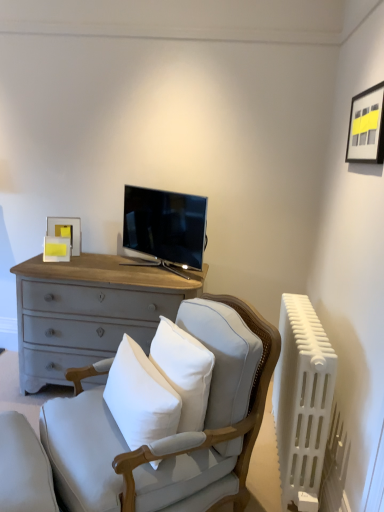
Find the location of a particular element. The image size is (384, 512). matte black picture frame at upper right, the 2th picture frame ordered from the bottom is located at coordinates (366, 127).

Measure the distance between matte black picture frame at upper right, the 2th picture frame ordered from the bottom, and camera.

matte black picture frame at upper right, the 2th picture frame ordered from the bottom, and camera are 1.76 meters apart.

What are the coordinates of `matte black tv at center` in the screenshot? It's located at (165, 229).

The image size is (384, 512). What do you see at coordinates (165, 229) in the screenshot? I see `matte black tv at center` at bounding box center [165, 229].

Where is `matte gray cushion at lower left`? The height and width of the screenshot is (512, 384). matte gray cushion at lower left is located at coordinates (23, 468).

Locate an element on the screen. This screenshot has width=384, height=512. matte black picture frame at upper right, which is counted as the 1th picture frame, starting from the right is located at coordinates coord(366,127).

Looking at this image, which object is further away from the camera taking this photo, matte gray cushion at lower left or matte black tv at center?

matte black tv at center is more distant.

Is matte gray cushion at lower left smaller than matte black tv at center?

Indeed, matte gray cushion at lower left has a smaller size compared to matte black tv at center.

From a real-world perspective, which is physically below, matte gray cushion at lower left or matte black tv at center?

matte gray cushion at lower left, from a real-world perspective.

You are a GUI agent. You are given a task and a screenshot of the screen. Output one action in this format:
    pyautogui.click(x=<x>, y=<y>)
    Task: Click on the gray below the matte black tv at center (from the image's perspective)
    This screenshot has width=384, height=512.
    Given the screenshot: What is the action you would take?
    pyautogui.click(x=23, y=468)

Considering the relative sizes of white cotton pillow at center and matte yellow picture frame at upper left, the 2th picture frame in the top-to-bottom sequence, in the image provided, is white cotton pillow at center wider than matte yellow picture frame at upper left, the 2th picture frame in the top-to-bottom sequence,?

Yes.

Are white cotton pillow at center and matte yellow picture frame at upper left, the 2th picture frame in the top-to-bottom sequence, far apart?

Indeed, white cotton pillow at center is not near matte yellow picture frame at upper left, the 2th picture frame in the top-to-bottom sequence.

From a real-world perspective, is white cotton pillow at center positioned under matte yellow picture frame at upper left, the 1th picture frame positioned from the bottom, based on gravity?

Yes.

In the image, there is a matte yellow picture frame at upper left, the 2th picture frame in the front-to-back sequence. Where is `pillow below it (from a real-world perspective)`? This screenshot has height=512, width=384. pillow below it (from a real-world perspective) is located at coordinates (140, 397).

Considering the positions of point (372, 109) and point (34, 488), is point (372, 109) closer or farther from the camera than point (34, 488)?

Clearly, point (372, 109) is more distant from the camera than point (34, 488).

From a real-world perspective, count 2nd picture frames upward from the matte gray cushion at lower left and point to it. Please provide its 2D coordinates.

[(366, 127)]

Does matte black picture frame at upper right, which is counted as the 1th picture frame, starting from the right, come behind matte gray cushion at lower left?

Yes.

Is matte black picture frame at upper right, which is counted as the 1th picture frame, starting from the top, shorter than matte gray cushion at lower left?

Correct, matte black picture frame at upper right, which is counted as the 1th picture frame, starting from the top, is not as tall as matte gray cushion at lower left.

Which of these two, matte black tv at center or light gray fabric rocking chair at center, is thinner?

matte black tv at center is thinner.

In the scene shown: Is matte black tv at center beside light gray fabric rocking chair at center?

Answer: matte black tv at center and light gray fabric rocking chair at center are clearly separated.

Based on the photo, between matte black tv at center and light gray fabric rocking chair at center, which one has more height?

light gray fabric rocking chair at center is taller.

Looking at this image, from the image's perspective, between matte black tv at center and light gray fabric rocking chair at center, which one is located above?

matte black tv at center.

Can you confirm if matte black picture frame at upper right, which is the second picture frame in back-to-front order, is bigger than light gray fabric rocking chair at center?

No, matte black picture frame at upper right, which is the second picture frame in back-to-front order, is not bigger than light gray fabric rocking chair at center.

Considering the points (379, 123) and (199, 474), which point is behind, point (379, 123) or point (199, 474)?

The point (379, 123) is farther.

From the image's perspective, between matte black picture frame at upper right, which is the second picture frame in back-to-front order, and light gray fabric rocking chair at center, which one is located above?

matte black picture frame at upper right, which is the second picture frame in back-to-front order, appears higher in the image.

Is white cotton pillow at center surrounding light gray fabric rocking chair at center?

No, light gray fabric rocking chair at center is not inside white cotton pillow at center.

Does point (128, 336) come behind point (92, 451)?

Yes, point (128, 336) is farther from viewer.

Can you confirm if white cotton pillow at center is taller than light gray fabric rocking chair at center?

No.

Is white cotton pillow at center not close to light gray fabric rocking chair at center?

No.

Between point (10, 471) and point (304, 482), which one is positioned in front?

The point (10, 471) is closer to the camera.

Considering the relative sizes of matte gray cushion at lower left and white plastic radiator at right in the image provided, is matte gray cushion at lower left smaller than white plastic radiator at right?

Yes.

Are matte gray cushion at lower left and white plastic radiator at right beside each other?

No, matte gray cushion at lower left is not touching white plastic radiator at right.

From the image's perspective, between matte gray cushion at lower left and white plastic radiator at right, who is located below?

matte gray cushion at lower left is shown below in the image.

Find the location of a particular element. This screenshot has height=512, width=384. television that is above the matte gray cushion at lower left (from the image's perspective) is located at coordinates (165, 229).

Find the location of a particular element. the 1st picture frame directly above the white cotton pillow at center (from a real-world perspective) is located at coordinates (66, 231).

From the image, which object appears to be farther from matte black picture frame at upper right, which is counted as the 1th picture frame, starting from the top, white cotton pillow at center or matte yellow picture frame at upper left, the 2th picture frame in the top-to-bottom sequence?

matte yellow picture frame at upper left, the 2th picture frame in the top-to-bottom sequence, lies further to matte black picture frame at upper right, which is counted as the 1th picture frame, starting from the top, than the other object.

Considering their positions, is matte gray cushion at lower left positioned further to white cotton pillow at center than white plastic radiator at right?

white plastic radiator at right is further to white cotton pillow at center.

When comparing their distances from matte black tv at center, does white cotton pillow at center or matte gray cushion at lower left seem further?

matte gray cushion at lower left is further to matte black tv at center.

Based on the photo, which object lies nearer to the anchor point matte black tv at center, light gray fabric rocking chair at center or white cotton pillow at center?

Among the two, white cotton pillow at center is located nearer to matte black tv at center.

Based on their spatial positions, is matte black picture frame at upper right, the 2th picture frame ordered from the bottom, or matte yellow picture frame at upper left, placed as the first picture frame when sorted from left to right, closer to matte black tv at center?

matte yellow picture frame at upper left, placed as the first picture frame when sorted from left to right, is closer to matte black tv at center.

Considering their positions, is white cotton pillow at center positioned further to matte yellow picture frame at upper left, the 1th picture frame positioned from the bottom, than light gray fabric rocking chair at center?

Based on the image, light gray fabric rocking chair at center appears to be further to matte yellow picture frame at upper left, the 1th picture frame positioned from the bottom.

Which object lies further to the anchor point matte yellow picture frame at upper left, which is the second picture frame from right to left, matte gray cushion at lower left or white cotton pillow at center?

The object further to matte yellow picture frame at upper left, which is the second picture frame from right to left, is matte gray cushion at lower left.

When comparing their distances from white cotton pillow at center, does matte black tv at center or white plastic radiator at right seem further?

Among the two, matte black tv at center is located further to white cotton pillow at center.

Locate an element on the screen. The height and width of the screenshot is (512, 384). television between matte black picture frame at upper right, which is counted as the 1th picture frame, starting from the right, and light gray fabric rocking chair at center from top to bottom is located at coordinates (165, 229).

Where is `radiator located between white cotton pillow at center and matte yellow picture frame at upper left, the 1th picture frame positioned from the bottom, in the depth direction`? The image size is (384, 512). radiator located between white cotton pillow at center and matte yellow picture frame at upper left, the 1th picture frame positioned from the bottom, in the depth direction is located at coordinates (302, 401).

Locate an element on the screen. Image resolution: width=384 pixels, height=512 pixels. television between matte gray cushion at lower left and matte yellow picture frame at upper left, placed as the first picture frame when sorted from left to right, in the front-back direction is located at coordinates (165, 229).

At what (x,y) coordinates should I click in order to perform the action: click on pillow that lies between matte black picture frame at upper right, which is the second picture frame in back-to-front order, and matte gray cushion at lower left from top to bottom. Please return your answer as a coordinate pair (x, y). The height and width of the screenshot is (512, 384). Looking at the image, I should click on (140, 397).